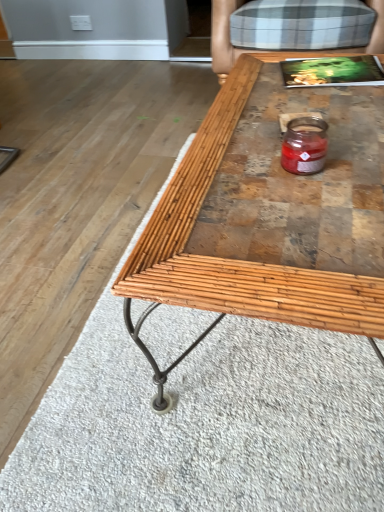
What is the approximate width of plaid fabric armchair at upper right?

plaid fabric armchair at upper right is 35.78 inches in width.

Where is `plaid fabric armchair at upper right`? The width and height of the screenshot is (384, 512). plaid fabric armchair at upper right is located at coordinates (223, 37).

The width and height of the screenshot is (384, 512). What do you see at coordinates (304, 145) in the screenshot? I see `translucent glass candle at center` at bounding box center [304, 145].

Locate an element on the screen. bamboo wood coffee table at center is located at coordinates (233, 260).

Based on the photo, how many degrees apart are the facing directions of translucent glass candle at center and plaid fabric armchair at upper right?

translucent glass candle at center and plaid fabric armchair at upper right are facing 89.1 degrees away from each other.

Who is smaller, translucent glass candle at center or plaid fabric armchair at upper right?

translucent glass candle at center is smaller.

Identify the location of armchair below the translucent glass candle at center (from a real-world perspective). The height and width of the screenshot is (512, 384). (223, 37).

Could you tell me if translucent glass candle at center is facing plaid fabric armchair at upper right?

No, translucent glass candle at center is not turned towards plaid fabric armchair at upper right.

In the image, is bamboo wood coffee table at center on the left side or the right side of translucent glass candle at center?

bamboo wood coffee table at center is to the right of translucent glass candle at center.

From a real-world perspective, who is located higher, bamboo wood coffee table at center or translucent glass candle at center?

In real-world perspective, translucent glass candle at center is above.

Is bamboo wood coffee table at center looking in the opposite direction of translucent glass candle at center?

bamboo wood coffee table at center is not turned away from translucent glass candle at center.

In the scene shown: Is plaid fabric armchair at upper right taller or shorter than bamboo wood coffee table at center?

In the image, plaid fabric armchair at upper right appears to be taller than bamboo wood coffee table at center.

Which of these two, plaid fabric armchair at upper right or bamboo wood coffee table at center, is thinner?

Thinner between the two is bamboo wood coffee table at center.

Can you confirm if plaid fabric armchair at upper right is bigger than bamboo wood coffee table at center?

Correct, plaid fabric armchair at upper right is larger in size than bamboo wood coffee table at center.

Considering the relative positions of plaid fabric armchair at upper right and translucent glass candle at center in the image provided, is plaid fabric armchair at upper right to the left of translucent glass candle at center from the viewer's perspective?

No, plaid fabric armchair at upper right is not to the left of translucent glass candle at center.

Does point (221, 30) come in front of point (297, 172)?

No, it is not.

Could you tell me if plaid fabric armchair at upper right is facing translucent glass candle at center?

Yes, plaid fabric armchair at upper right is oriented towards translucent glass candle at center.

From the picture: Does plaid fabric armchair at upper right come behind translucent glass candle at center?

Yes, plaid fabric armchair at upper right is behind translucent glass candle at center.

Consider the image. Does bamboo wood coffee table at center turn towards plaid fabric armchair at upper right?

No.

Considering the points (289, 311) and (215, 53), which point is behind, point (289, 311) or point (215, 53)?

The point (215, 53) is farther from the camera.

Considering the relative sizes of bamboo wood coffee table at center and plaid fabric armchair at upper right in the image provided, is bamboo wood coffee table at center smaller than plaid fabric armchair at upper right?

Yes.

In the scene shown: Does bamboo wood coffee table at center have a greater width compared to plaid fabric armchair at upper right?

No, bamboo wood coffee table at center is not wider than plaid fabric armchair at upper right.

Can you see translucent glass candle at center touching bamboo wood coffee table at center?

translucent glass candle at center and bamboo wood coffee table at center are not in contact.

Does translucent glass candle at center come behind bamboo wood coffee table at center?

Yes.

Locate an element on the screen. The height and width of the screenshot is (512, 384). coffee table below the translucent glass candle at center (from a real-world perspective) is located at coordinates (233, 260).

How different are the orientations of translucent glass candle at center and bamboo wood coffee table at center in degrees?

0.00104 degrees.

You are a GUI agent. You are given a task and a screenshot of the screen. Output one action in this format:
    pyautogui.click(x=<x>, y=<y>)
    Task: Click on the armchair on the right of translucent glass candle at center
    This screenshot has width=384, height=512.
    Given the screenshot: What is the action you would take?
    pyautogui.click(x=223, y=37)

The image size is (384, 512). Find the location of `glass jar lying on the left of bamboo wood coffee table at center`. glass jar lying on the left of bamboo wood coffee table at center is located at coordinates (304, 145).

Which object lies nearer to the anchor point translucent glass candle at center, plaid fabric armchair at upper right or bamboo wood coffee table at center?

bamboo wood coffee table at center is positioned closer to the anchor translucent glass candle at center.

Which object lies nearer to the anchor point plaid fabric armchair at upper right, bamboo wood coffee table at center or translucent glass candle at center?

bamboo wood coffee table at center.

When comparing their distances from translucent glass candle at center, does bamboo wood coffee table at center or plaid fabric armchair at upper right seem closer?

Based on the image, bamboo wood coffee table at center appears to be nearer to translucent glass candle at center.

Based on the photo, considering their positions, is translucent glass candle at center positioned further to bamboo wood coffee table at center than plaid fabric armchair at upper right?

plaid fabric armchair at upper right is further to bamboo wood coffee table at center.

Looking at the image, which one is located closer to bamboo wood coffee table at center, plaid fabric armchair at upper right or translucent glass candle at center?

Based on the image, translucent glass candle at center appears to be nearer to bamboo wood coffee table at center.

Looking at the image, which one is located closer to plaid fabric armchair at upper right, translucent glass candle at center or bamboo wood coffee table at center?

bamboo wood coffee table at center is closer to plaid fabric armchair at upper right.

The image size is (384, 512). What are the coordinates of `glass jar that lies between plaid fabric armchair at upper right and bamboo wood coffee table at center from top to bottom` in the screenshot? It's located at (304, 145).